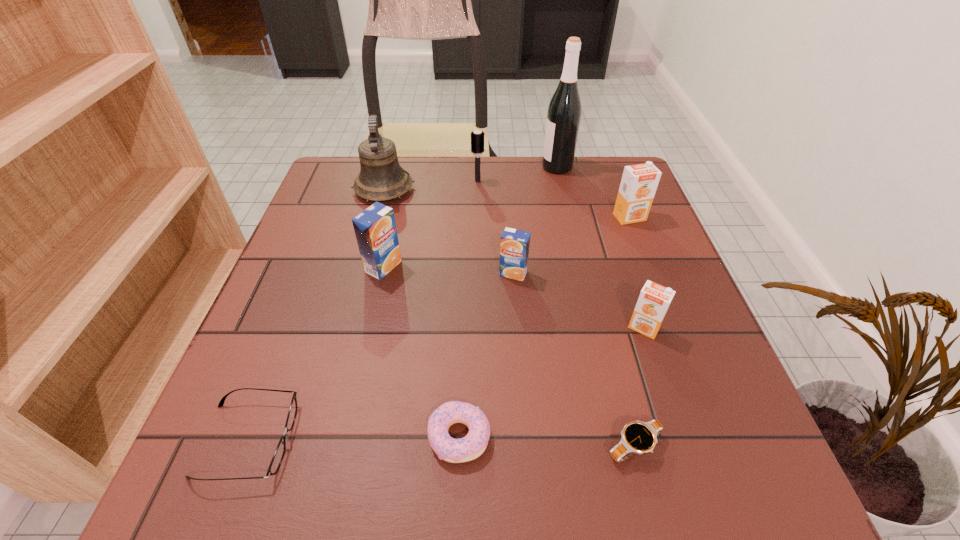
Identify the location of vacant space at the near edge of the desktop. (416, 494).

The image size is (960, 540). What are the coordinates of `blank space at the left edge of the desktop` in the screenshot? It's located at (339, 206).

Where is `vacant area at the right edge`? vacant area at the right edge is located at coordinates (619, 245).

Image resolution: width=960 pixels, height=540 pixels. In order to click on free region at the far left corner of the desktop in this screenshot , I will do `click(343, 199)`.

Locate an element on the screen. The height and width of the screenshot is (540, 960). vacant area at the far right corner of the desktop is located at coordinates (594, 157).

This screenshot has height=540, width=960. I want to click on vacant space at the near right corner, so click(x=728, y=479).

Where is `empty space between the hairbrush and the spectacles`? The height and width of the screenshot is (540, 960). empty space between the hairbrush and the spectacles is located at coordinates (363, 310).

Locate an element on the screen. This screenshot has width=960, height=540. free space between the hairbrush and the ninth shortest object is located at coordinates (431, 185).

Find the location of a particular element. This screenshot has width=960, height=540. unoccupied position between the bigger orange orange juice and the ninth shortest object is located at coordinates (507, 203).

Identify the location of free space between the nearer orange orange juice and the black watch. This screenshot has height=540, width=960. (638, 387).